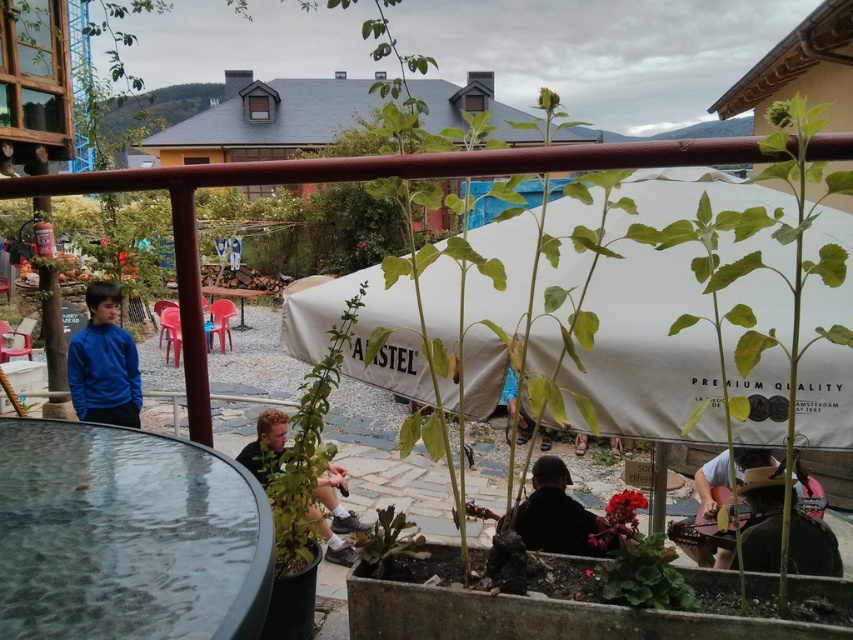
Does white canvas canopy at center appear on the left side of wooden table at center?

In fact, white canvas canopy at center is to the right of wooden table at center.

Does point (676, 385) come closer to viewer compared to point (231, 292)?

Yes, it is.

Where is `white canvas canopy at center`? white canvas canopy at center is located at coordinates (647, 348).

Looking at this image, which is below, white canvas canopy at center or blue fleece jacket at left?

Positioned lower is blue fleece jacket at left.

Can you confirm if white canvas canopy at center is positioned to the left of blue fleece jacket at left?

No, white canvas canopy at center is not to the left of blue fleece jacket at left.

Does point (756, 280) lie in front of point (76, 358)?

Yes, it is in front of point (76, 358).

Where is `white canvas canopy at center`? The width and height of the screenshot is (853, 640). white canvas canopy at center is located at coordinates (647, 348).

Does transparent glass table at lower left have a greater height compared to green leafy plant at center?

No.

Which is above, transparent glass table at lower left or green leafy plant at center?

transparent glass table at lower left is higher up.

Who is more distant from viewer, (125, 465) or (379, 529)?

Point (379, 529)

Locate an element on the screen. Image resolution: width=853 pixels, height=640 pixels. transparent glass table at lower left is located at coordinates (126, 536).